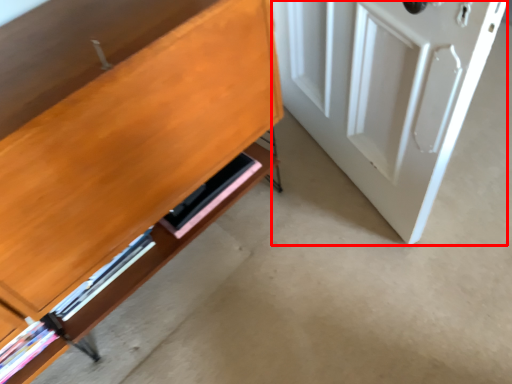
Question: Observing the image, what is the correct spatial positioning of door (annotated by the red box) in reference to shelf?

Choices:
 (A) right
 (B) left

Answer: (A)